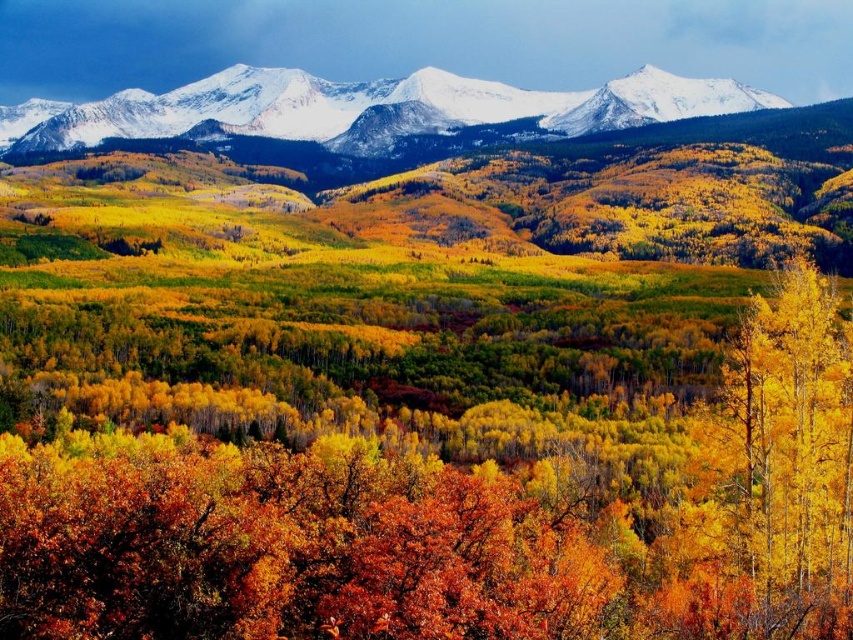
Measure the distance between point (733, 508) and camera.

Point (733, 508) is 166.48 meters from camera.

Based on the photo, can you confirm if yellow smooth tree at right is wider than snowy white mountains at upper center?

No, yellow smooth tree at right is not wider than snowy white mountains at upper center.

The width and height of the screenshot is (853, 640). What are the coordinates of `yellow smooth tree at right` in the screenshot? It's located at (773, 477).